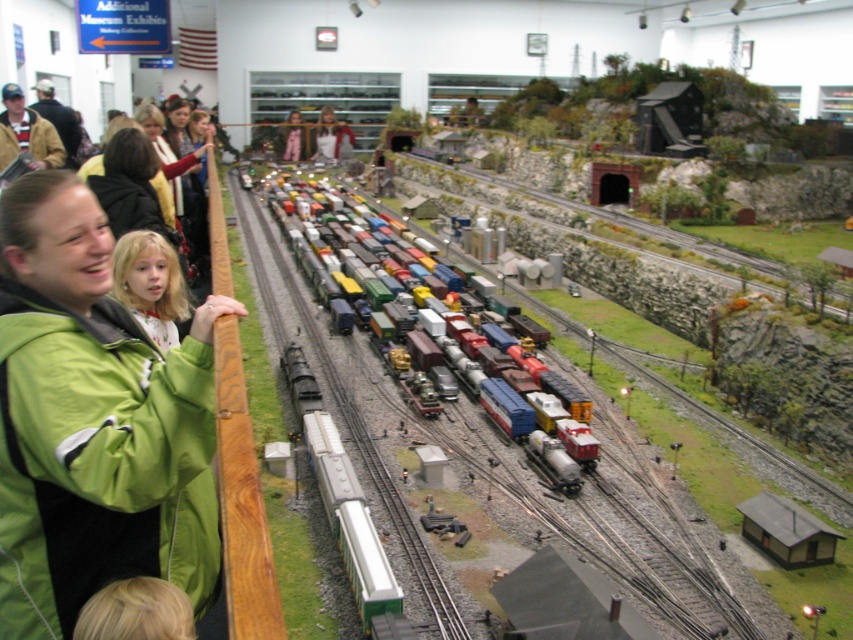
Is metallic silver train track at center below matte pink sweater at center?

Yes.

Image resolution: width=853 pixels, height=640 pixels. What are the coordinates of `metallic silver train track at center` in the screenshot? It's located at (519, 467).

Is khaki cotton jacket at upper left bigger than brown leather jacket at upper left?

No, khaki cotton jacket at upper left is not bigger than brown leather jacket at upper left.

From the picture: Does khaki cotton jacket at upper left have a smaller size compared to brown leather jacket at upper left?

Yes, khaki cotton jacket at upper left is smaller than brown leather jacket at upper left.

Which is in front, point (12, 92) or point (51, 120)?

Positioned in front is point (12, 92).

I want to click on khaki cotton jacket at upper left, so click(x=26, y=131).

Who is taller, green fabric jacket at left or metallic silver train track at center?

metallic silver train track at center

The height and width of the screenshot is (640, 853). Describe the element at coordinates (93, 420) in the screenshot. I see `green fabric jacket at left` at that location.

Is point (202, 426) closer to camera compared to point (502, 467)?

That is True.

What are the coordinates of `green fabric jacket at left` in the screenshot? It's located at pos(93,420).